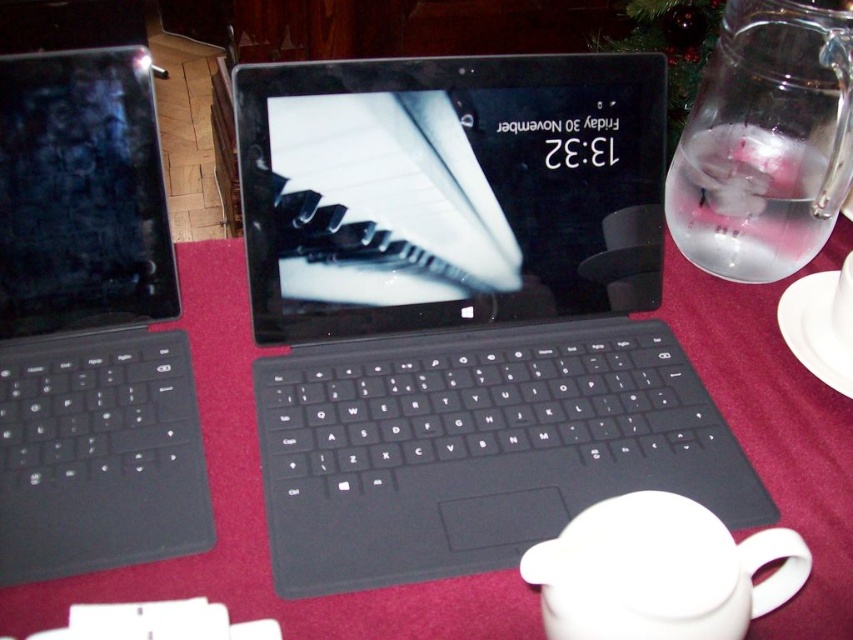
Locate an element on the screen. Image resolution: width=853 pixels, height=640 pixels. matte black laptop at left is located at coordinates (90, 324).

Can you confirm if matte black laptop at left is positioned to the left of black glossy tablet at left?

Incorrect, matte black laptop at left is not on the left side of black glossy tablet at left.

Does point (117, 480) come in front of point (148, 115)?

Yes.

Find the location of a particular element. This screenshot has height=640, width=853. matte black laptop at left is located at coordinates (90, 324).

Does matte black tablet at center appear over white matte mug at center?

Indeed, matte black tablet at center is positioned over white matte mug at center.

Does matte black tablet at center have a lesser height compared to white matte mug at center?

In fact, matte black tablet at center may be taller than white matte mug at center.

This screenshot has width=853, height=640. I want to click on matte black tablet at center, so click(x=450, y=189).

Between matte black tablet at center and red fabric tablecloth at center, which one appears on the left side from the viewer's perspective?

matte black tablet at center is more to the left.

Where is `matte black tablet at center`? matte black tablet at center is located at coordinates (450, 189).